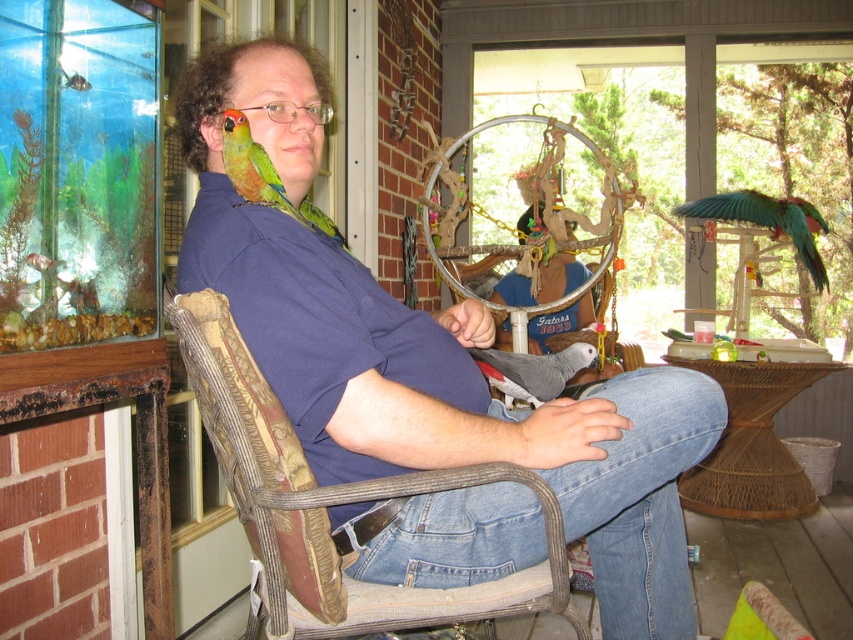
Question: Which point appears closest to the camera in this image?

Choices:
 (A) (526, 371)
 (B) (268, 182)
 (C) (355, 589)

Answer: (C)

Question: Considering the real-world distances, which object is farthest from the gray matte parrot at lower center?

Choices:
 (A) woven fabric chair at center
 (B) blue cotton shirt at center
 (C) green metallic parrot at right

Answer: (C)

Question: Which of the following is the farthest from the observer?

Choices:
 (A) (496, 401)
 (B) (570, 348)
 (C) (242, 192)

Answer: (B)

Question: Is green metallic parrot at right thinner than gray matte parrot at lower center?

Choices:
 (A) yes
 (B) no

Answer: (B)

Question: Can you confirm if blue cotton shirt at center is smaller than green metallic parrot at right?

Choices:
 (A) no
 (B) yes

Answer: (A)

Question: From the image, what is the correct spatial relationship of green metallic parrot at right in relation to green matte parrot at left?

Choices:
 (A) left
 (B) right

Answer: (B)